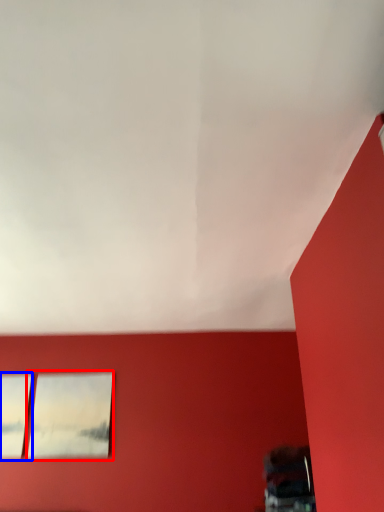
Question: Which object appears farthest to the camera in this image, picture frame (highlighted by a red box) or window (highlighted by a blue box)?

Choices:
 (A) picture frame
 (B) window

Answer: (A)